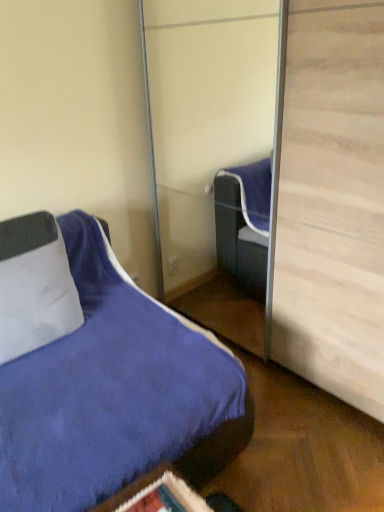
Locate an element on the screen. The width and height of the screenshot is (384, 512). white textured pillow at left is located at coordinates (34, 286).

What do you see at coordinates (34, 286) in the screenshot?
I see `white textured pillow at left` at bounding box center [34, 286].

Identify the location of suede blue bed at lower left. (114, 393).

Describe the element at coordinates (114, 393) in the screenshot. I see `suede blue bed at lower left` at that location.

At what (x,y) coordinates should I click in order to perform the action: click on white textured pillow at left. Please return your answer as a coordinate pair (x, y). This screenshot has width=384, height=512. Looking at the image, I should click on (34, 286).

Based on the photo, can you confirm if white textured pillow at left is positioned to the right of suede blue bed at lower left?

In fact, white textured pillow at left is to the left of suede blue bed at lower left.

Is white textured pillow at left in front of suede blue bed at lower left?

No, it is behind suede blue bed at lower left.

Does point (15, 306) lie in front of point (241, 368)?

That is False.

Looking at this image, from the image's perspective, is white textured pillow at left on top of suede blue bed at lower left?

Yes, from the image's perspective, white textured pillow at left is above suede blue bed at lower left.

From a real-world perspective, between white textured pillow at left and suede blue bed at lower left, who is vertically higher?

white textured pillow at left, from a real-world perspective.

Between white textured pillow at left and suede blue bed at lower left, which one has larger width?

Wider between the two is suede blue bed at lower left.

Does white textured pillow at left have a lesser height compared to suede blue bed at lower left?

Yes, white textured pillow at left is shorter than suede blue bed at lower left.

Which of these two, white textured pillow at left or suede blue bed at lower left, is smaller?

white textured pillow at left.

Is white textured pillow at left outside of suede blue bed at lower left?

That's incorrect, white textured pillow at left is not completely outside suede blue bed at lower left.

Is white textured pillow at left positioned far away from suede blue bed at lower left?

That's not correct — white textured pillow at left is a little close to suede blue bed at lower left.

Is white textured pillow at left oriented away from suede blue bed at lower left?

That's right, white textured pillow at left is facing away from suede blue bed at lower left.

How many degrees apart are the facing directions of white textured pillow at left and suede blue bed at lower left?

The angular difference between white textured pillow at left and suede blue bed at lower left is 3.08 degrees.

Identify the location of bed located below the white textured pillow at left (from the image's perspective). (114, 393).

Based on their positions, is suede blue bed at lower left located to the left or right of white textured pillow at left?

Clearly, suede blue bed at lower left is on the right of white textured pillow at left in the image.

Is suede blue bed at lower left closer to camera compared to white textured pillow at left?

Yes, suede blue bed at lower left is closer to the viewer.

Does point (196, 435) lie behind point (11, 328)?

No.

From the image's perspective, is suede blue bed at lower left positioned above or below white textured pillow at left?

suede blue bed at lower left is below white textured pillow at left.

From a real-world perspective, between suede blue bed at lower left and white textured pillow at left, who is vertically lower?

suede blue bed at lower left, from a real-world perspective.

Considering the sizes of suede blue bed at lower left and white textured pillow at left in the image, is suede blue bed at lower left wider or thinner than white textured pillow at left?

Clearly, suede blue bed at lower left has more width compared to white textured pillow at left.

In terms of height, does suede blue bed at lower left look taller or shorter compared to white textured pillow at left?

suede blue bed at lower left is taller than white textured pillow at left.

Which of these two, suede blue bed at lower left or white textured pillow at left, is smaller?

With smaller size is white textured pillow at left.

From the picture: Would you say suede blue bed at lower left is inside or outside white textured pillow at left?

suede blue bed at lower left is located beyond the bounds of white textured pillow at left.

Is suede blue bed at lower left touching white textured pillow at left?

No.

Could you tell me if suede blue bed at lower left is facing white textured pillow at left?

No.

Can you tell me how much suede blue bed at lower left and white textured pillow at left differ in facing direction?

There is a 3.08-degree angle between the facing directions of suede blue bed at lower left and white textured pillow at left.

The image size is (384, 512). I want to click on bed on the right of white textured pillow at left, so click(x=114, y=393).

At what (x,y) coordinates should I click in order to perform the action: click on bed in front of the white textured pillow at left. Please return your answer as a coordinate pair (x, y). The image size is (384, 512). Looking at the image, I should click on pyautogui.click(x=114, y=393).

What are the coordinates of `bed that is below the white textured pillow at left (from the image's perspective)` in the screenshot? It's located at (114, 393).